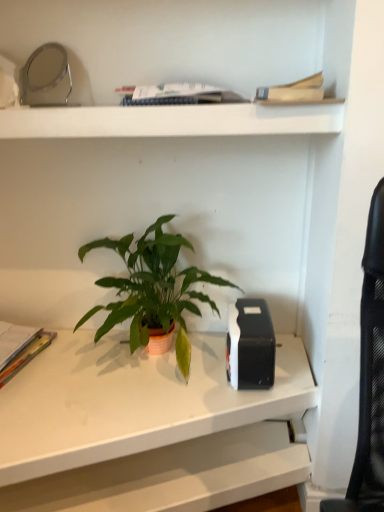
The image size is (384, 512). In order to click on free space in front of green matte houseplant at center in this screenshot , I will do `click(112, 421)`.